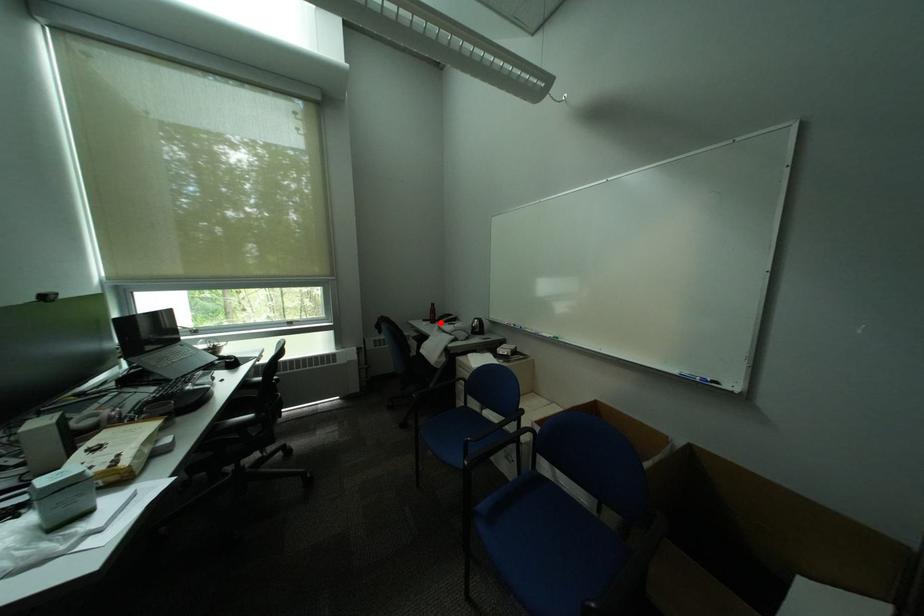
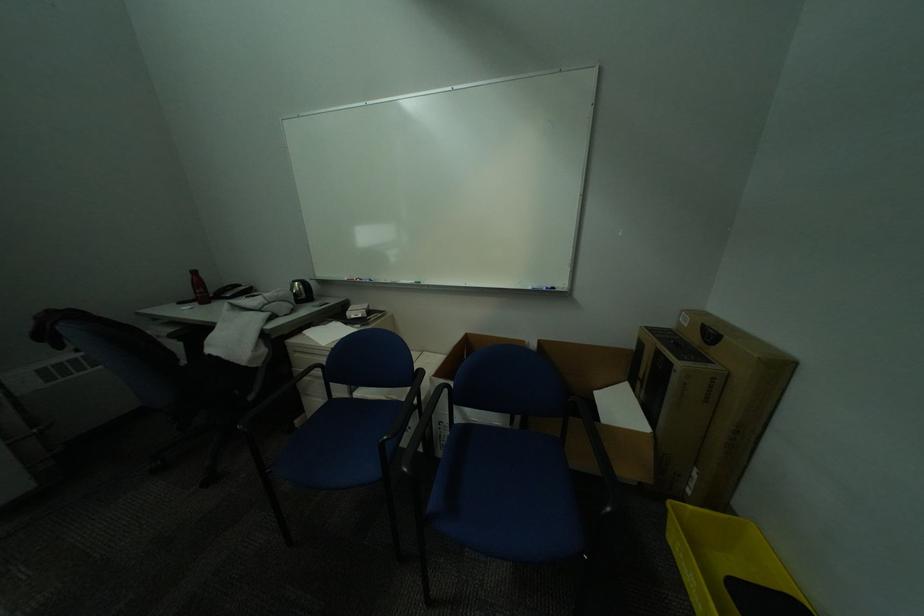
The point at the highlighted location is marked in the first image. Where is the corresponding point in the second image?

(208, 304)